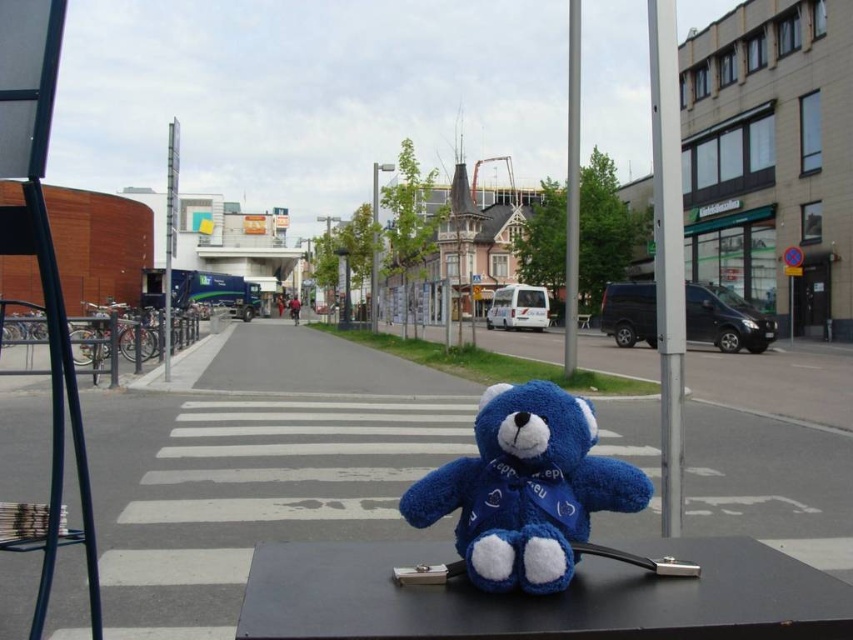
You are inside a car and notice a silver metallic pole at right through the window. Can you determine its exact position using coordinates?

The silver metallic pole at right is located at coordinates point (666, 250).

You are a delivery robot with a maximum delivery range of 20 meters. You need to deliver a package from the velvety blue teddy bear at center to the metallic pole at upper center. Can you complete the delivery within your range?

The distance between the velvety blue teddy bear at center and the metallic pole at upper center is 20.81 meters, which exceeds your 20 meter range. You cannot complete the delivery within your range.